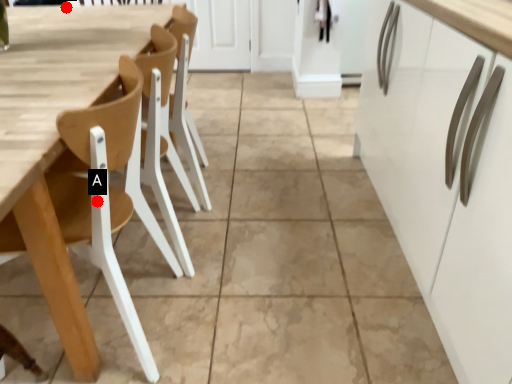
Question: Two points are circled on the image, labeled by A and B beside each circle. Which point is farther to the camera?

Choices:
 (A) A is further
 (B) B is further

Answer: (B)